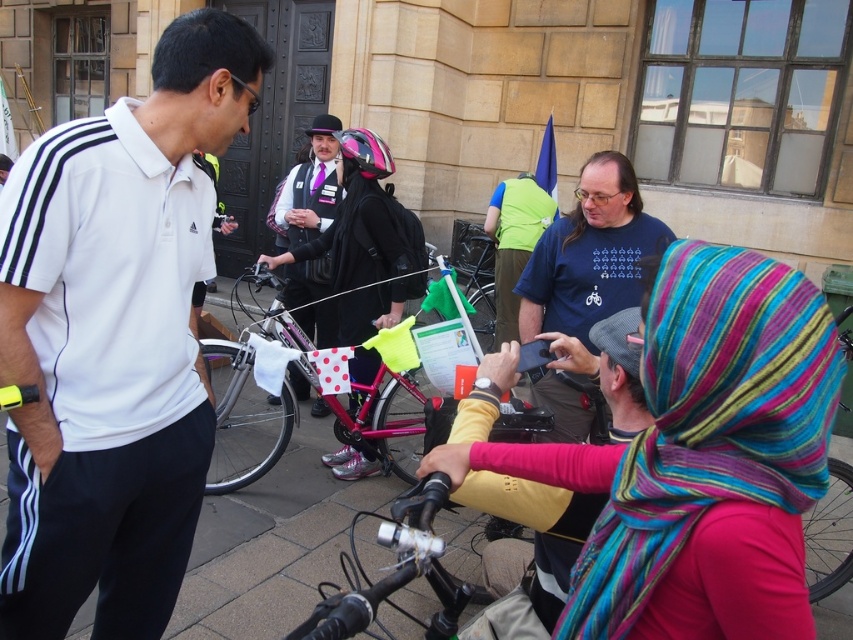
Is white matte polo shirt at left smaller than multicolored striped scarf at center?

No, white matte polo shirt at left is not smaller than multicolored striped scarf at center.

Does white matte polo shirt at left appear on the right side of multicolored striped scarf at center?

Incorrect, white matte polo shirt at left is not on the right side of multicolored striped scarf at center.

Is point (125, 484) behind point (781, 500)?

Yes, it is behind point (781, 500).

Locate an element on the screen. The width and height of the screenshot is (853, 640). white matte polo shirt at left is located at coordinates (115, 339).

Between blue cotton t-shirt at upper center and pink matte helmet at center, which one has less height?

blue cotton t-shirt at upper center

Who is more forward, (x=544, y=292) or (x=376, y=156)?

Point (x=544, y=292) is more forward.

Is point (573, 282) farther from viewer compared to point (361, 349)?

No, it is not.

Locate an element on the screen. This screenshot has width=853, height=640. blue cotton t-shirt at upper center is located at coordinates (590, 253).

At what (x,y) coordinates should I click in order to perform the action: click on white matte polo shirt at left. Please return your answer as a coordinate pair (x, y). Looking at the image, I should click on (115, 339).

Is point (83, 428) positioned before point (270, 339)?

Yes, point (83, 428) is in front of point (270, 339).

Identify the location of white matte polo shirt at left. (115, 339).